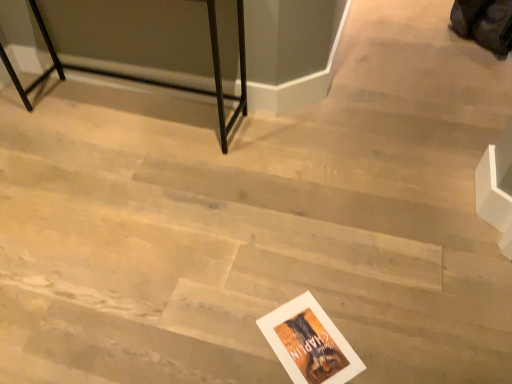
Find the location of a particular element. The width and height of the screenshot is (512, 384). free space above white paper postcard at lower center (from a real-world perspective) is located at coordinates (311, 340).